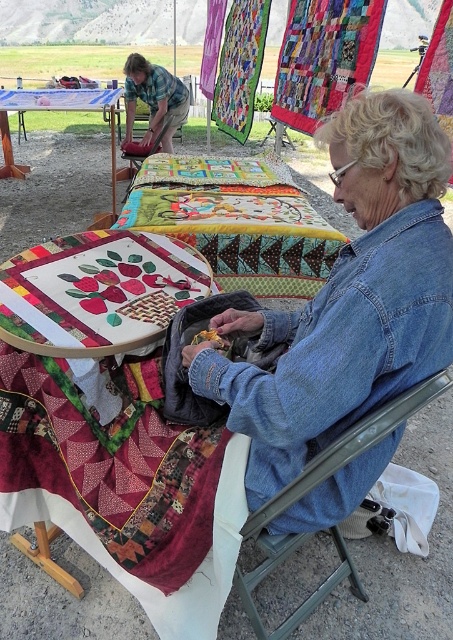
Is metallic gray folding chair at lower right above brushed metal bucket at upper left?

Incorrect, metallic gray folding chair at lower right is not positioned above brushed metal bucket at upper left.

Between point (292, 488) and point (150, 74), which one is positioned in front?

Point (292, 488) is more forward.

Where is `metallic gray folding chair at lower right`? The height and width of the screenshot is (640, 453). metallic gray folding chair at lower right is located at coordinates (332, 525).

Consider the image. Can you confirm if embroidered fabric tablecloth at center is thinner than metallic gray folding chair at lower right?

In fact, embroidered fabric tablecloth at center might be wider than metallic gray folding chair at lower right.

In order to click on embroidered fabric tablecloth at center in this screenshot , I will do `click(97, 292)`.

Can you confirm if embroidered fabric tablecloth at center is thinner than multicolored quilt at center?

Yes, embroidered fabric tablecloth at center is thinner than multicolored quilt at center.

Is embroidered fabric tablecloth at center smaller than multicolored quilt at center?

Yes.

I want to click on embroidered fabric tablecloth at center, so click(97, 292).